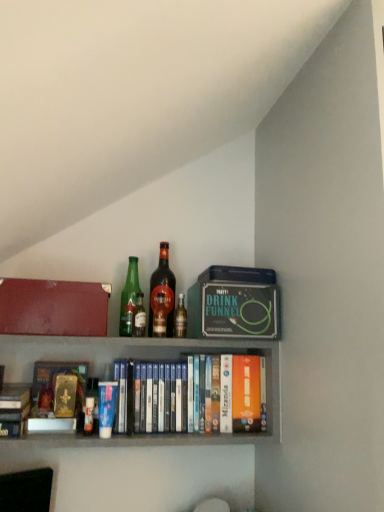
Question: From the image's perspective, is green glass bottle at center, which is the first bottle in left-to-right order, beneath wooden books at center?

Choices:
 (A) yes
 (B) no

Answer: (B)

Question: Can you confirm if green glass bottle at center, which is the first bottle in left-to-right order, is smaller than wooden books at center?

Choices:
 (A) no
 (B) yes

Answer: (B)

Question: Is wooden books at center at the back of green glass bottle at center, which is the first bottle in left-to-right order?

Choices:
 (A) yes
 (B) no

Answer: (B)

Question: Is green glass bottle at center, arranged as the 4th bottle when viewed from the right, placed right next to wooden books at center?

Choices:
 (A) yes
 (B) no

Answer: (B)

Question: Considering the relative sizes of green glass bottle at center, which is the first bottle in left-to-right order, and wooden books at center in the image provided, is green glass bottle at center, which is the first bottle in left-to-right order, wider than wooden books at center?

Choices:
 (A) yes
 (B) no

Answer: (B)

Question: From a real-world perspective, relative to blue matte paperback book at lower left, which is the second paperback book from back to front, is translucent glass bottle at center, the first bottle when ordered from right to left, vertically above or below?

Choices:
 (A) above
 (B) below

Answer: (A)

Question: Do you think translucent glass bottle at center, the first bottle when ordered from right to left, is within blue matte paperback book at lower left, which is counted as the first paperback book, starting from the front, or outside of it?

Choices:
 (A) outside
 (B) inside

Answer: (A)

Question: Considering the positions of translucent glass bottle at center, which is counted as the 4th bottle, starting from the left, and blue matte paperback book at lower left, which is counted as the first paperback book, starting from the front, in the image, is translucent glass bottle at center, which is counted as the 4th bottle, starting from the left, bigger or smaller than blue matte paperback book at lower left, which is counted as the first paperback book, starting from the front,?

Choices:
 (A) big
 (B) small

Answer: (B)

Question: Does point (178, 310) appear closer or farther from the camera than point (105, 389)?

Choices:
 (A) farther
 (B) closer

Answer: (A)

Question: In terms of size, does green glass bottle at center, the third bottle positioned from the right, appear bigger or smaller than matte red box at upper left?

Choices:
 (A) small
 (B) big

Answer: (A)

Question: Considering the positions of green glass bottle at center, which is the 2th bottle in left-to-right order, and matte red box at upper left in the image, is green glass bottle at center, which is the 2th bottle in left-to-right order, wider or thinner than matte red box at upper left?

Choices:
 (A) wide
 (B) thin

Answer: (B)

Question: From a real-world perspective, is green glass bottle at center, the third bottle positioned from the right, above or below matte red box at upper left?

Choices:
 (A) above
 (B) below

Answer: (B)

Question: Visually, is green glass bottle at center, which is the 2th bottle in left-to-right order, positioned to the left or to the right of matte red box at upper left?

Choices:
 (A) right
 (B) left

Answer: (A)

Question: From a real-world perspective, is blue matte paperback book at lower left, positioned as the 2th paperback book in top-to-bottom order, above or below green glass bottle at center, which is the 2th bottle in left-to-right order?

Choices:
 (A) above
 (B) below

Answer: (B)

Question: Does point (100, 432) appear closer or farther from the camera than point (142, 322)?

Choices:
 (A) farther
 (B) closer

Answer: (B)